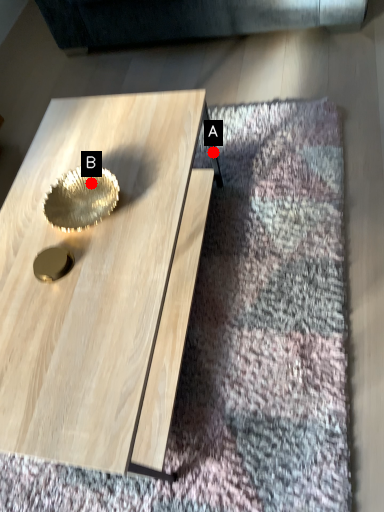
Question: Two points are circled on the image, labeled by A and B beside each circle. Among these points, which one is nearest to the camera?

Choices:
 (A) A is closer
 (B) B is closer

Answer: (B)